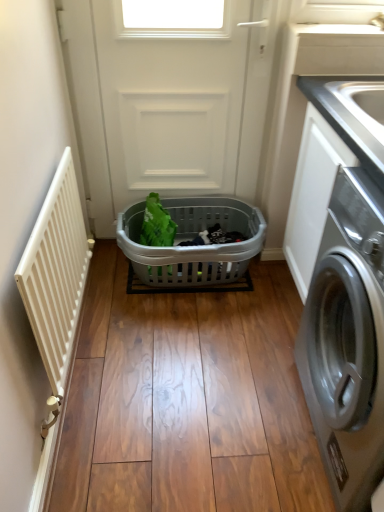
Find the location of a particular element. white matte screen door at center is located at coordinates (171, 97).

This screenshot has height=512, width=384. What do you see at coordinates (56, 273) in the screenshot?
I see `white matte radiator at left` at bounding box center [56, 273].

Find the location of `gray plastic basket at center`. gray plastic basket at center is located at coordinates (191, 239).

The width and height of the screenshot is (384, 512). What do you see at coordinates (352, 114) in the screenshot?
I see `white glossy countertop at upper right` at bounding box center [352, 114].

Where is `white matte screen door at center`? The height and width of the screenshot is (512, 384). white matte screen door at center is located at coordinates (171, 97).

You are a GUI agent. You are given a task and a screenshot of the screen. Output one action in this format:
    pyautogui.click(x=<x>, y=<y>)
    Task: Click on the counter top behind the silver metallic washing machine at right
    
    Given the screenshot: What is the action you would take?
    pyautogui.click(x=352, y=114)

Is silver metallic washing machine at right oriented towards white glossy countertop at upper right?

No, silver metallic washing machine at right is not turned towards white glossy countertop at upper right.

Is silver metallic washing machine at right in front of or behind white glossy countertop at upper right in the image?

Clearly, silver metallic washing machine at right is in front of white glossy countertop at upper right.

How different are the orientations of white matte radiator at left and white glossy countertop at upper right in degrees?

The angle between the facing direction of white matte radiator at left and the facing direction of white glossy countertop at upper right is 180 degrees.

Is white matte radiator at left facing towards white glossy countertop at upper right?

Yes, white matte radiator at left is oriented towards white glossy countertop at upper right.

Is the depth of white matte radiator at left greater than that of white glossy countertop at upper right?

No, it is in front of white glossy countertop at upper right.

Considering the relative sizes of white matte radiator at left and white glossy countertop at upper right in the image provided, is white matte radiator at left bigger than white glossy countertop at upper right?

Correct, white matte radiator at left is larger in size than white glossy countertop at upper right.

From the image's perspective, is white glossy countertop at upper right below white matte radiator at left?

No.

In terms of width, does white glossy countertop at upper right look wider or thinner when compared to white matte radiator at left?

Considering their sizes, white glossy countertop at upper right looks broader than white matte radiator at left.

Is white glossy countertop at upper right oriented away from white matte radiator at left?

No, white glossy countertop at upper right's orientation is not away from white matte radiator at left.

Which is in front, point (339, 119) or point (27, 282)?

Positioned in front is point (27, 282).

Is silver metallic washing machine at right facing towards white matte radiator at left?

Yes.

In terms of width, does silver metallic washing machine at right look wider or thinner when compared to white matte radiator at left?

In the image, silver metallic washing machine at right appears to be wider than white matte radiator at left.

Consider the image. Which is behind, silver metallic washing machine at right or white matte radiator at left?

white matte radiator at left is further away from the camera.

From a real-world perspective, is white glossy countertop at upper right located higher than silver metallic washing machine at right?

Yes, from a real-world perspective, white glossy countertop at upper right is above silver metallic washing machine at right.

In the scene shown: How different are the orientations of white glossy countertop at upper right and silver metallic washing machine at right in degrees?

0.862 degrees separate the facing orientations of white glossy countertop at upper right and silver metallic washing machine at right.

Does white glossy countertop at upper right appear on the left side of silver metallic washing machine at right?

Incorrect, white glossy countertop at upper right is not on the left side of silver metallic washing machine at right.

Which of these two, white glossy countertop at upper right or gray plastic basket at center, is wider?

With larger width is gray plastic basket at center.

From a real-world perspective, which is physically above, white glossy countertop at upper right or gray plastic basket at center?

white glossy countertop at upper right.

Measure the distance between white glossy countertop at upper right and gray plastic basket at center.

A distance of 76.92 centimeters exists between white glossy countertop at upper right and gray plastic basket at center.

Is white glossy countertop at upper right in front of or behind white matte screen door at center in the image?

In the image, white glossy countertop at upper right appears in front of white matte screen door at center.

Can you see white glossy countertop at upper right touching white matte screen door at center?

They are not placed beside each other.

How many degrees apart are the facing directions of white glossy countertop at upper right and white matte screen door at center?

white glossy countertop at upper right and white matte screen door at center are facing 89 degrees away from each other.

From the image's perspective, does white glossy countertop at upper right appear lower than white matte screen door at center?

Yes, from the image's perspective, white glossy countertop at upper right is below white matte screen door at center.

This screenshot has width=384, height=512. I want to click on washing machine lying on the left of white glossy countertop at upper right, so click(x=347, y=340).

The image size is (384, 512). I want to click on counter top above the white matte radiator at left (from a real-world perspective), so click(352, 114).

Which object lies further to the anchor point silver metallic washing machine at right, white matte screen door at center or gray plastic basket at center?

Based on the image, white matte screen door at center appears to be further to silver metallic washing machine at right.

From the image, which object appears to be nearer to white matte radiator at left, white glossy countertop at upper right or gray plastic basket at center?

Based on the image, gray plastic basket at center appears to be nearer to white matte radiator at left.

From the image, which object appears to be farther from silver metallic washing machine at right, white glossy countertop at upper right or gray plastic basket at center?

gray plastic basket at center.

Estimate the real-world distances between objects in this image. Which object is further from white matte radiator at left, silver metallic washing machine at right or gray plastic basket at center?

silver metallic washing machine at right is further to white matte radiator at left.

Estimate the real-world distances between objects in this image. Which object is further from gray plastic basket at center, silver metallic washing machine at right or white matte screen door at center?

silver metallic washing machine at right lies further to gray plastic basket at center than the other object.

Based on their spatial positions, is white glossy countertop at upper right or silver metallic washing machine at right further from gray plastic basket at center?

white glossy countertop at upper right is positioned further to the anchor gray plastic basket at center.

When comparing their distances from white matte radiator at left, does silver metallic washing machine at right or white glossy countertop at upper right seem closer?

Based on the image, silver metallic washing machine at right appears to be nearer to white matte radiator at left.

Considering their positions, is white matte radiator at left positioned further to white matte screen door at center than gray plastic basket at center?

white matte radiator at left is positioned further to the anchor white matte screen door at center.

Where is `counter top between silver metallic washing machine at right and white matte screen door at center along the z-axis`? This screenshot has width=384, height=512. counter top between silver metallic washing machine at right and white matte screen door at center along the z-axis is located at coordinates (352, 114).

Where is `washing machine situated between white matte radiator at left and white glossy countertop at upper right from left to right`? The width and height of the screenshot is (384, 512). washing machine situated between white matte radiator at left and white glossy countertop at upper right from left to right is located at coordinates (347, 340).

Where is `basket located between white matte radiator at left and white glossy countertop at upper right in the left-right direction`? basket located between white matte radiator at left and white glossy countertop at upper right in the left-right direction is located at coordinates (191, 239).

Image resolution: width=384 pixels, height=512 pixels. What are the coordinates of `screen door between silver metallic washing machine at right and gray plastic basket at center in the front-back direction` in the screenshot? It's located at (171, 97).